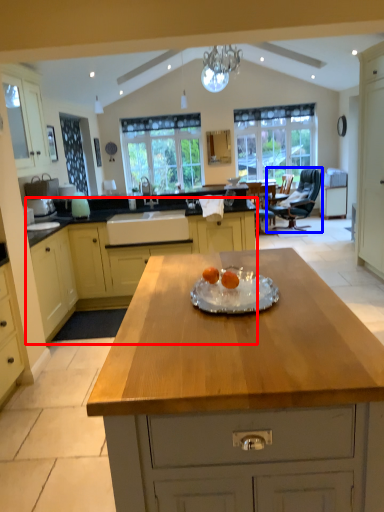
Question: Among these objects, which one is farthest to the camera, cabinetry (highlighted by a red box) or chair (highlighted by a blue box)?

Choices:
 (A) cabinetry
 (B) chair

Answer: (B)